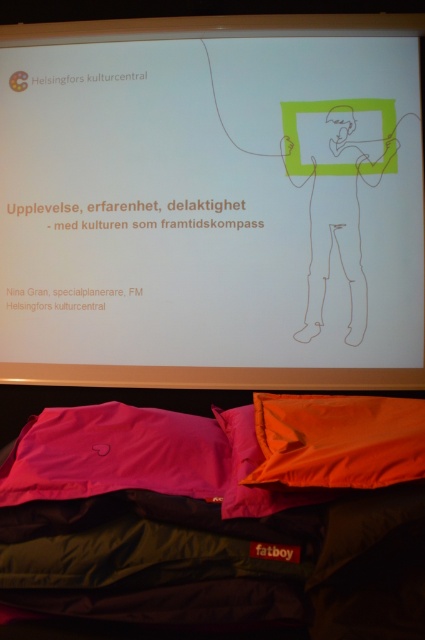
Image resolution: width=425 pixels, height=640 pixels. What do you see at coordinates (115, 452) in the screenshot?
I see `pink fabric pillow at lower left` at bounding box center [115, 452].

The height and width of the screenshot is (640, 425). Describe the element at coordinates (115, 452) in the screenshot. I see `pink fabric pillow at lower left` at that location.

Locate an element on the screen. pink fabric pillow at lower left is located at coordinates (115, 452).

Can you confirm if pink fabric pillow at lower left is positioned to the left of orange fabric pillow at lower center?

Indeed, pink fabric pillow at lower left is positioned on the left side of orange fabric pillow at lower center.

Which is more to the left, pink fabric pillow at lower left or orange fabric pillow at lower center?

Positioned to the left is pink fabric pillow at lower left.

This screenshot has width=425, height=640. What are the coordinates of `pink fabric pillow at lower left` in the screenshot? It's located at (115, 452).

Which is more to the left, brown line drawing man at upper right or orange fabric pillow at lower center?

From the viewer's perspective, orange fabric pillow at lower center appears more on the left side.

Who is positioned more to the right, brown line drawing man at upper right or orange fabric pillow at lower center?

brown line drawing man at upper right is more to the right.

Is point (286, 131) closer to camera compared to point (254, 410)?

No, it is not.

Locate an element on the screen. brown line drawing man at upper right is located at coordinates (345, 202).